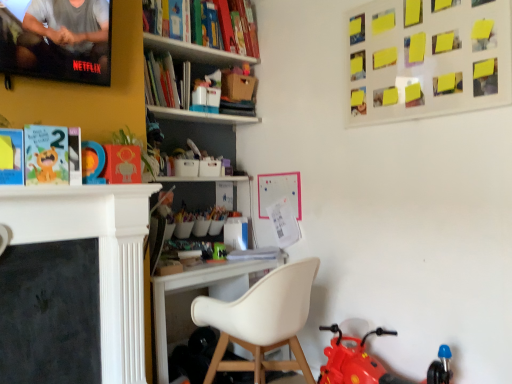
Question: Should I look upward or downward to see matte paper book at left?

Choices:
 (A) down
 (B) up

Answer: (B)

Question: From the image's perspective, is white matte chair at center located beneath rubberized red toy motorcycle at lower right, arranged as the 3th toy when viewed from the top?

Choices:
 (A) yes
 (B) no

Answer: (B)

Question: Is white matte chair at center thinner than rubberized red toy motorcycle at lower right, which is the third toy from left to right?

Choices:
 (A) yes
 (B) no

Answer: (B)

Question: Is white matte chair at center wider than rubberized red toy motorcycle at lower right, which is counted as the first toy, starting from the front?

Choices:
 (A) no
 (B) yes

Answer: (B)

Question: Is white matte chair at center not inside rubberized red toy motorcycle at lower right, arranged as the 3th toy when viewed from the top?

Choices:
 (A) yes
 (B) no

Answer: (A)

Question: From a real-world perspective, is white matte chair at center under rubberized red toy motorcycle at lower right, which is counted as the first toy, starting from the front?

Choices:
 (A) yes
 (B) no

Answer: (B)

Question: Does white matte chair at center turn towards rubberized red toy motorcycle at lower right, which is the third toy from left to right?

Choices:
 (A) yes
 (B) no

Answer: (B)

Question: Does matte plastic number at center, the first toy when ordered from top to bottom, have a greater height compared to rubberized red toy motorcycle at lower right, which is the 1th toy from right to left?

Choices:
 (A) no
 (B) yes

Answer: (A)

Question: Is matte plastic number at center, the first toy when ordered from top to bottom, shorter than rubberized red toy motorcycle at lower right, arranged as the 3th toy when viewed from the top?

Choices:
 (A) yes
 (B) no

Answer: (A)

Question: From a real-world perspective, is matte plastic number at center, the third toy positioned from the right, physically below rubberized red toy motorcycle at lower right, which is the third toy from left to right?

Choices:
 (A) yes
 (B) no

Answer: (B)

Question: Is rubberized red toy motorcycle at lower right, which is the third toy from left to right, a part of matte plastic number at center, the first toy when ordered from top to bottom?

Choices:
 (A) yes
 (B) no

Answer: (B)

Question: Does matte plastic number at center, which appears as the 2th toy when viewed from the front, have a greater width compared to rubberized red toy motorcycle at lower right, arranged as the 3th toy when viewed from the top?

Choices:
 (A) yes
 (B) no

Answer: (B)

Question: From the image's perspective, is matte plastic number at center, placed as the 3th toy when sorted from bottom to top, on rubberized red toy motorcycle at lower right, which is counted as the 3th toy, starting from the back?

Choices:
 (A) yes
 (B) no

Answer: (A)

Question: Considering the relative sizes of matte paper book at left and green plastic toy at center, marked as the 2th toy in a bottom-to-top arrangement, in the image provided, is matte paper book at left thinner than green plastic toy at center, marked as the 2th toy in a bottom-to-top arrangement,?

Choices:
 (A) no
 (B) yes

Answer: (B)